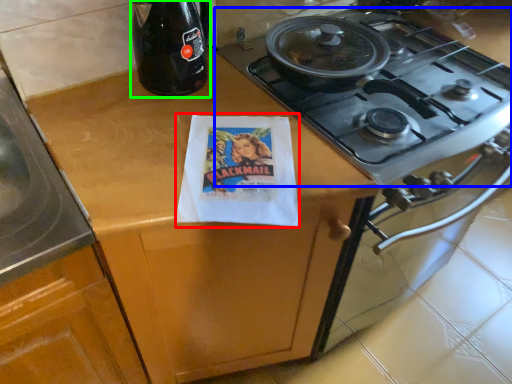
Question: Considering the real-world distances, which object is closest to flyer (highlighted by a red box)? gas stove (highlighted by a blue box) or bottle (highlighted by a green box).

Choices:
 (A) gas stove
 (B) bottle

Answer: (B)